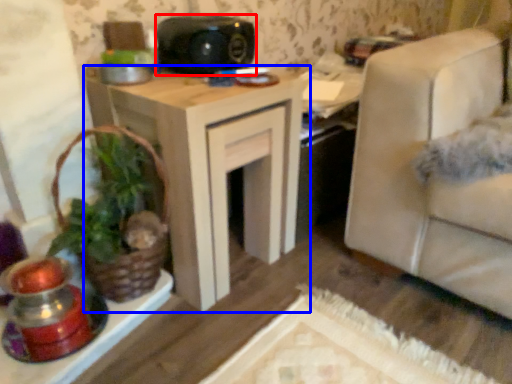
Question: Among these objects, which one is farthest to the camera, speaker (highlighted by a red box) or table (highlighted by a blue box)?

Choices:
 (A) speaker
 (B) table

Answer: (A)